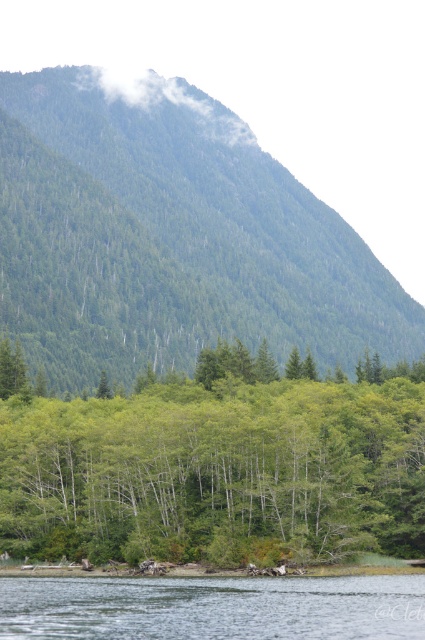
Question: Which of the following is the farthest from the observer?

Choices:
 (A) (232, 177)
 (B) (339, 612)
 (C) (40, 412)

Answer: (A)

Question: Does green forested mountain at upper center appear under clear water at lower center?

Choices:
 (A) no
 (B) yes

Answer: (A)

Question: Is green forested mountain at upper center wider than clear water at lower center?

Choices:
 (A) no
 (B) yes

Answer: (B)

Question: Is green forested mountain at upper center to the left of clear water at lower center from the viewer's perspective?

Choices:
 (A) no
 (B) yes

Answer: (B)

Question: Among these objects, which one is farthest from the camera?

Choices:
 (A) green forested mountain at upper center
 (B) clear water at lower center

Answer: (A)

Question: Which is farther from the green forested mountain at upper center?

Choices:
 (A) green matte trees at center
 (B) clear water at lower center

Answer: (B)